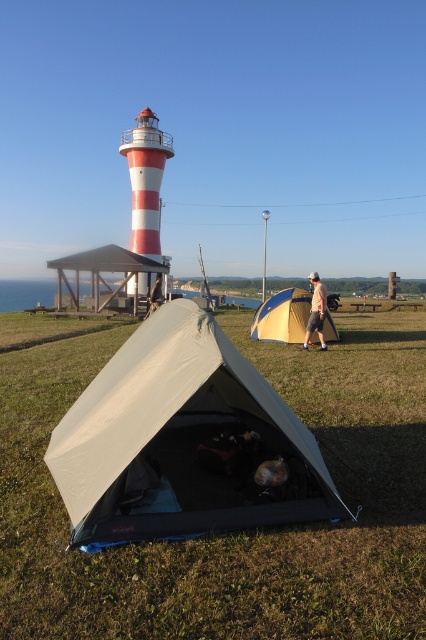
Question: Does matte gray tent at center have a greater width compared to light brown leather jacket at center?

Choices:
 (A) no
 (B) yes

Answer: (B)

Question: Which point is farther to the camera?

Choices:
 (A) (83, 253)
 (B) (298, 332)
 (C) (308, 333)

Answer: (A)

Question: Among these objects, which one is farthest from the camera?

Choices:
 (A) light brown leather jacket at center
 (B) pink fabric tent at center
 (C) white plastic tent at center

Answer: (A)

Question: Which of the following is the closest to the observer?

Choices:
 (A) (314, 323)
 (B) (163, 416)
 (C) (160, 276)
 (D) (299, 323)

Answer: (B)

Question: Can you confirm if matte gray tent at center is smaller than yellow fabric tent at center?

Choices:
 (A) yes
 (B) no

Answer: (B)

Question: Is white plastic tent at center further to the viewer compared to light brown leather jacket at center?

Choices:
 (A) no
 (B) yes

Answer: (A)